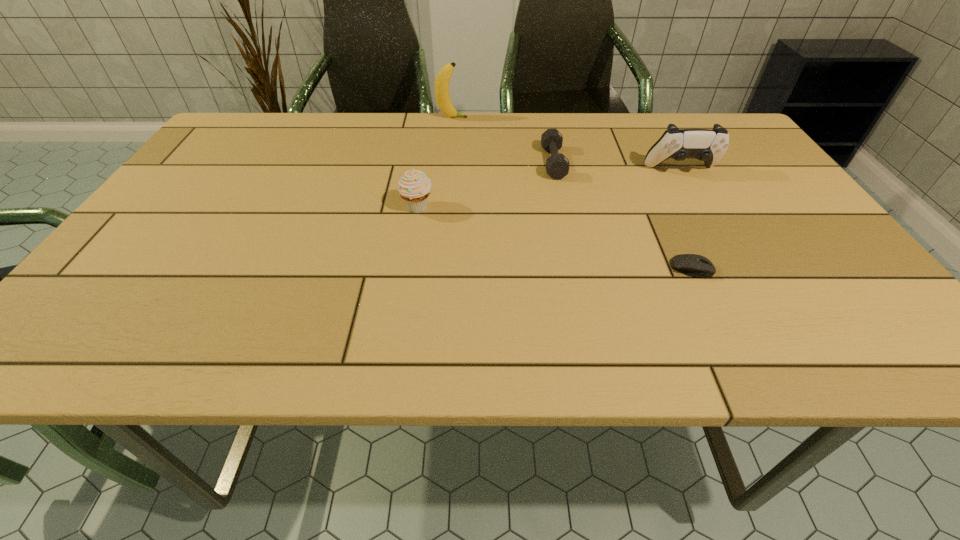
Locate an element on the screen. This screenshot has height=540, width=960. free point that satisfies the following two spatial constraints: 1. from the stem of the banana; 2. on the right side of the third object from left to right is located at coordinates (447, 163).

You are a GUI agent. You are given a task and a screenshot of the screen. Output one action in this format:
    pyautogui.click(x=<x>, y=<y>)
    Task: Click on the free point that satisfies the following two spatial constraints: 1. from the stem of the banana; 2. on the front side of the second nearest object
    
    Given the screenshot: What is the action you would take?
    click(444, 208)

Identify the location of vacant space that satisfies the following two spatial constraints: 1. from the stem of the dumbbell; 2. on the right side of the tallest object. (447, 163).

Locate an element on the screen. vacant area in the image that satisfies the following two spatial constraints: 1. on the front side of the second shortest object; 2. on the left side of the nearest object is located at coordinates (576, 268).